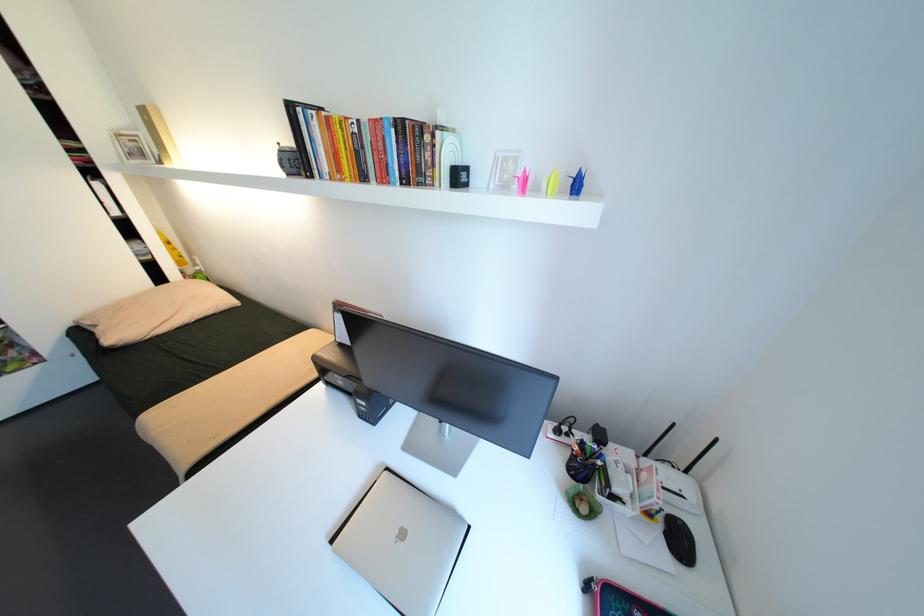
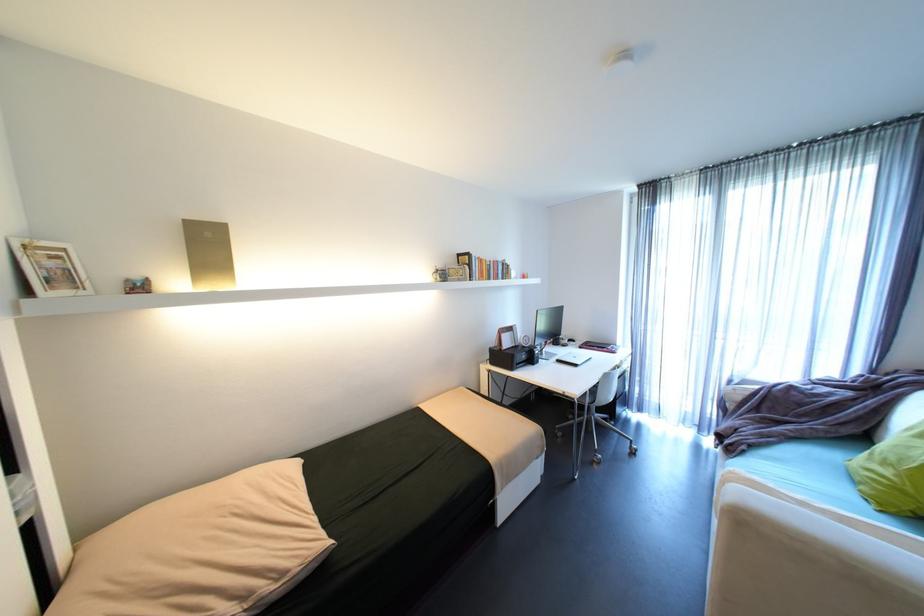
Find the pixel in the second image that matches point (286, 144) in the first image.

(444, 267)